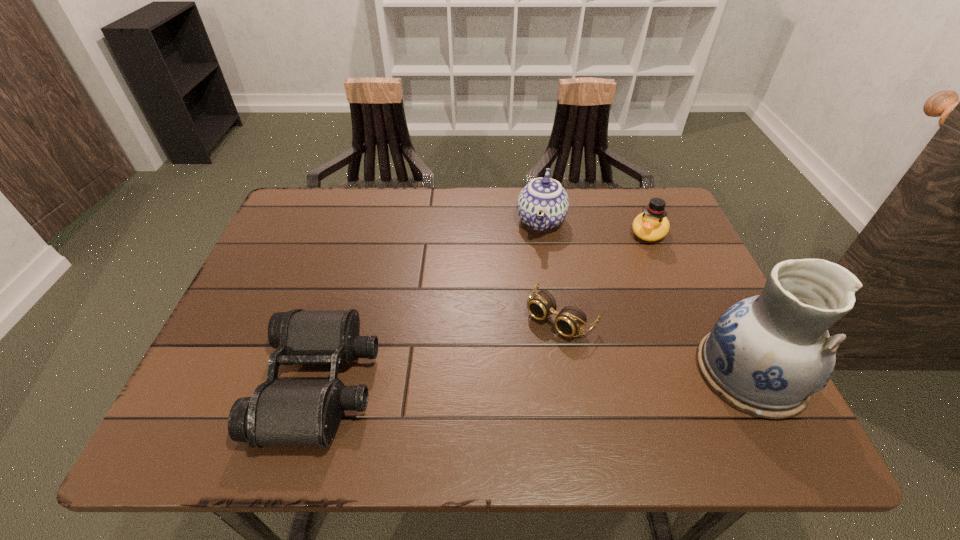
The width and height of the screenshot is (960, 540). What are the coordinates of `binoculars` in the screenshot? It's located at (281, 412).

Find the location of a particular element. The image size is (960, 540). the leftmost object is located at coordinates (281, 412).

The image size is (960, 540). Find the location of `the tallest object`. the tallest object is located at coordinates (766, 355).

Locate an element on the screen. Image resolution: width=960 pixels, height=540 pixels. chinaware is located at coordinates (543, 204).

Where is `the third shortest object`? The width and height of the screenshot is (960, 540). the third shortest object is located at coordinates (651, 225).

This screenshot has width=960, height=540. Find the location of `the shortest object`. the shortest object is located at coordinates (570, 320).

Where is `free spot located through the eyepieces of the binoculars`? This screenshot has width=960, height=540. free spot located through the eyepieces of the binoculars is located at coordinates (542, 383).

The image size is (960, 540). In order to click on free space located 0.180m on the back of the pottery in this screenshot , I will do tap(701, 274).

Locate an element on the screen. This screenshot has width=960, height=540. vacant position located from the spout of the chinaware is located at coordinates (510, 370).

Locate an element on the screen. This screenshot has height=540, width=960. free space located 0.120m from the spout of the chinaware is located at coordinates (532, 278).